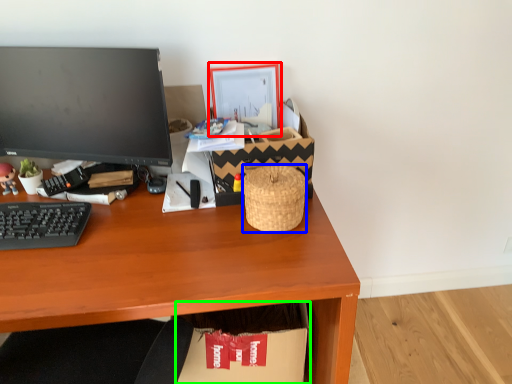
Question: Considering the real-world distances, which object is closest to picture frame (highlighted by a red box)? basket (highlighted by a blue box) or cardboard box (highlighted by a green box).

Choices:
 (A) basket
 (B) cardboard box

Answer: (A)